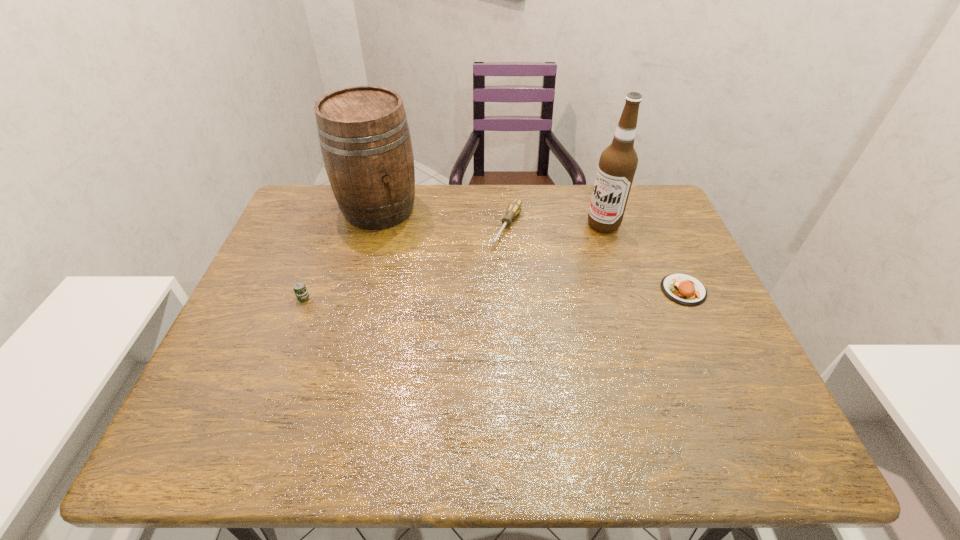
Identify the location of vacant space on the desktop that is between the third tallest object and the rightmost object and is positioned at the tip of the third object from right to left. This screenshot has height=540, width=960. (468, 294).

Find the location of a particular element. Image resolution: width=960 pixels, height=540 pixels. vacant space on the desktop that is between the beer can and the rightmost object and is positioned on the label of the fourth object from left to right is located at coordinates (509, 293).

Identify the location of free space on the desktop that is between the beer can and the rightmost object and is positioned on the side of the second tallest object near the bung hole. (442, 295).